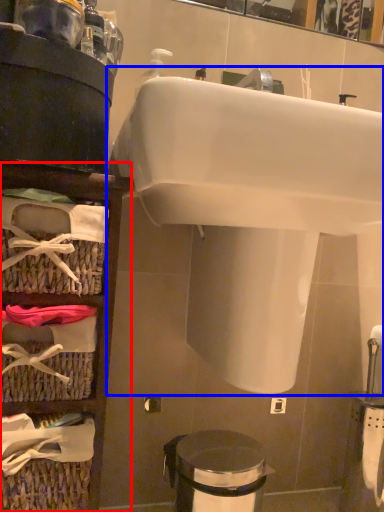
Question: Which object is further to the camera taking this photo, shelf (highlighted by a red box) or sink (highlighted by a blue box)?

Choices:
 (A) shelf
 (B) sink

Answer: (A)